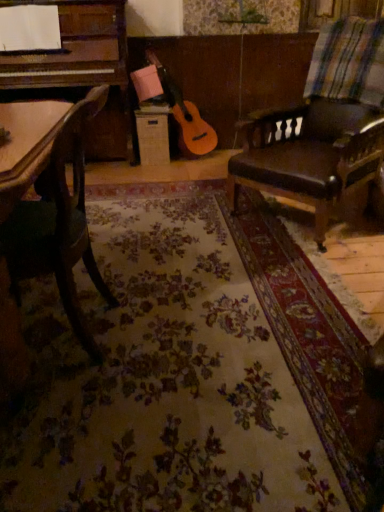
Where is `leather cushioned chair at right, which is the second chair in front-to-back order`? Image resolution: width=384 pixels, height=512 pixels. leather cushioned chair at right, which is the second chair in front-to-back order is located at coordinates (311, 152).

What is the approximate width of leather cushioned chair at right, the second chair positioned from the left?

32.47 inches.

Where is `multicolored woven blanket at upper right`? This screenshot has width=384, height=512. multicolored woven blanket at upper right is located at coordinates (348, 62).

Locate an element on the screen. green fabric chair at left, which is the second chair from right to left is located at coordinates (59, 224).

This screenshot has height=512, width=384. I want to click on leather cushioned chair at right, which is the second chair in front-to-back order, so click(311, 152).

Is leather cushioned chair at right, which appears as the first chair when viewed from the back, located within multicolored woven blanket at upper right?

No, leather cushioned chair at right, which appears as the first chair when viewed from the back, is not surrounded by multicolored woven blanket at upper right.

How far apart are multicolored woven blanket at upper right and leather cushioned chair at right, arranged as the 1th chair when viewed from the right?

multicolored woven blanket at upper right is 11.40 inches from leather cushioned chair at right, arranged as the 1th chair when viewed from the right.

Which of these two, multicolored woven blanket at upper right or leather cushioned chair at right, which is the second chair in front-to-back order, is wider?

leather cushioned chair at right, which is the second chair in front-to-back order.

Does multicolored woven blanket at upper right touch leather cushioned chair at right, the second chair positioned from the left?

multicolored woven blanket at upper right and leather cushioned chair at right, the second chair positioned from the left, are not in contact.

From their relative heights in the image, would you say leather cushioned chair at right, the second chair positioned from the left, is taller or shorter than green fabric chair at left, the second chair from the back?

leather cushioned chair at right, the second chair positioned from the left, is taller than green fabric chair at left, the second chair from the back.

Considering the positions of objects leather cushioned chair at right, arranged as the 1th chair when viewed from the right, and green fabric chair at left, the first chair positioned from the left, in the image provided, who is more to the right, leather cushioned chair at right, arranged as the 1th chair when viewed from the right, or green fabric chair at left, the first chair positioned from the left,?

leather cushioned chair at right, arranged as the 1th chair when viewed from the right, is more to the right.

Does leather cushioned chair at right, the second chair positioned from the left, turn towards green fabric chair at left, which is the second chair from right to left?

Yes.

Between leather cushioned chair at right, which appears as the first chair when viewed from the back, and green fabric chair at left, which is counted as the 1th chair, starting from the front, which one has smaller size?

green fabric chair at left, which is counted as the 1th chair, starting from the front, is smaller.

From a real-world perspective, is green fabric chair at left, which is the second chair from right to left, physically below leather cushioned chair at right, arranged as the 1th chair when viewed from the right?

Indeed, from a real-world perspective, green fabric chair at left, which is the second chair from right to left, is positioned beneath leather cushioned chair at right, arranged as the 1th chair when viewed from the right.

Where is `chair located above the green fabric chair at left, the second chair from the back (from the image's perspective)`? The width and height of the screenshot is (384, 512). chair located above the green fabric chair at left, the second chair from the back (from the image's perspective) is located at coordinates (311, 152).

Is green fabric chair at left, the first chair positioned from the left, thinner than leather cushioned chair at right, which is the second chair in front-to-back order?

Yes, green fabric chair at left, the first chair positioned from the left, is thinner than leather cushioned chair at right, which is the second chair in front-to-back order.

Measure the distance from green fabric chair at left, the first chair positioned from the left, to leather cushioned chair at right, which is the second chair in front-to-back order.

A distance of 4.06 feet exists between green fabric chair at left, the first chair positioned from the left, and leather cushioned chair at right, which is the second chair in front-to-back order.

Considering the relative positions of multicolored woven blanket at upper right and green fabric chair at left, the second chair from the back, in the image provided, is multicolored woven blanket at upper right to the left or to the right of green fabric chair at left, the second chair from the back,?

multicolored woven blanket at upper right is to the right of green fabric chair at left, the second chair from the back.

Would you consider multicolored woven blanket at upper right to be distant from green fabric chair at left, which is counted as the 1th chair, starting from the front?

That's right, there is a large distance between multicolored woven blanket at upper right and green fabric chair at left, which is counted as the 1th chair, starting from the front.

Looking at this image, from the image's perspective, is multicolored woven blanket at upper right located above green fabric chair at left, which is the second chair from right to left?

Yes, from the image's perspective, multicolored woven blanket at upper right is above green fabric chair at left, which is the second chair from right to left.

At what (x,y) coordinates should I click in order to perform the action: click on the 2nd chair positioned below the multicolored woven blanket at upper right (from a real-world perspective). Please return your answer as a coordinate pair (x, y). The width and height of the screenshot is (384, 512). Looking at the image, I should click on (59, 224).

In the scene shown: Is green fabric chair at left, which is the second chair from right to left, spatially inside multicolored woven blanket at upper right, or outside of it?

green fabric chair at left, which is the second chair from right to left, lies outside multicolored woven blanket at upper right.

Is green fabric chair at left, the second chair from the back, bigger than multicolored woven blanket at upper right?

Yes, green fabric chair at left, the second chair from the back, is bigger than multicolored woven blanket at upper right.

From the image's perspective, is green fabric chair at left, the first chair positioned from the left, above or below multicolored woven blanket at upper right?

From the image's perspective, green fabric chair at left, the first chair positioned from the left, appears below multicolored woven blanket at upper right.

Is point (83, 221) farther from camera compared to point (318, 59)?

No, (83, 221) is in front of (318, 59).

In terms of width, does leather cushioned chair at right, which appears as the first chair when viewed from the back, look wider or thinner when compared to multicolored woven blanket at upper right?

Considering their sizes, leather cushioned chair at right, which appears as the first chair when viewed from the back, looks broader than multicolored woven blanket at upper right.

Is leather cushioned chair at right, the second chair positioned from the left, looking in the opposite direction of multicolored woven blanket at upper right?

Absolutely, leather cushioned chair at right, the second chair positioned from the left, is directed away from multicolored woven blanket at upper right.

From the image's perspective, is leather cushioned chair at right, arranged as the 1th chair when viewed from the right, located beneath multicolored woven blanket at upper right?

Correct, leather cushioned chair at right, arranged as the 1th chair when viewed from the right, appears lower than multicolored woven blanket at upper right in the image.

Would you say leather cushioned chair at right, which appears as the first chair when viewed from the back, is to the left or to the right of multicolored woven blanket at upper right in the picture?

From the image, it's evident that leather cushioned chair at right, which appears as the first chair when viewed from the back, is to the left of multicolored woven blanket at upper right.

From the image's perspective, count 1st chairs downward from the multicolored woven blanket at upper right and point to it. Please provide its 2D coordinates.

[(311, 152)]

Identify the location of chair above the green fabric chair at left, the first chair positioned from the left (from the image's perspective). (311, 152).

When comparing their distances from leather cushioned chair at right, the second chair positioned from the left, does multicolored woven blanket at upper right or green fabric chair at left, the first chair positioned from the left, seem closer?

The object closer to leather cushioned chair at right, the second chair positioned from the left, is multicolored woven blanket at upper right.

When comparing their distances from green fabric chair at left, the first chair positioned from the left, does leather cushioned chair at right, the second chair positioned from the left, or multicolored woven blanket at upper right seem further?

multicolored woven blanket at upper right.

Considering their positions, is green fabric chair at left, the first chair positioned from the left, positioned further to leather cushioned chair at right, which is the second chair in front-to-back order, than multicolored woven blanket at upper right?

The object further to leather cushioned chair at right, which is the second chair in front-to-back order, is green fabric chair at left, the first chair positioned from the left.

Which object lies nearer to the anchor point green fabric chair at left, which is counted as the 1th chair, starting from the front, multicolored woven blanket at upper right or leather cushioned chair at right, which appears as the first chair when viewed from the back?

Among the two, leather cushioned chair at right, which appears as the first chair when viewed from the back, is located nearer to green fabric chair at left, which is counted as the 1th chair, starting from the front.

Looking at the image, which one is located further to multicolored woven blanket at upper right, leather cushioned chair at right, arranged as the 1th chair when viewed from the right, or green fabric chair at left, which is the second chair from right to left?

green fabric chair at left, which is the second chair from right to left, is further to multicolored woven blanket at upper right.

Based on their spatial positions, is green fabric chair at left, which is the second chair from right to left, or leather cushioned chair at right, which is the second chair in front-to-back order, closer to multicolored woven blanket at upper right?

Based on the image, leather cushioned chair at right, which is the second chair in front-to-back order, appears to be nearer to multicolored woven blanket at upper right.

Where is `chair between green fabric chair at left, which is counted as the 1th chair, starting from the front, and multicolored woven blanket at upper right from left to right`? chair between green fabric chair at left, which is counted as the 1th chair, starting from the front, and multicolored woven blanket at upper right from left to right is located at coordinates (311, 152).